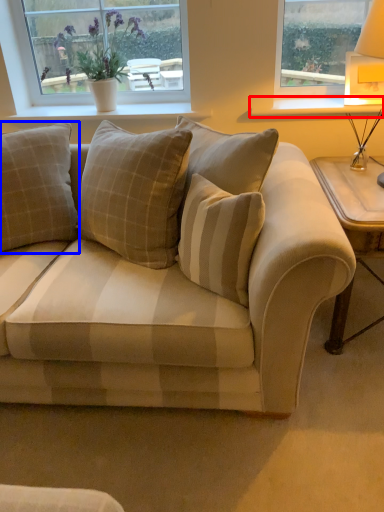
Question: Which object is further to the camera taking this photo, window sill (highlighted by a red box) or pillow (highlighted by a blue box)?

Choices:
 (A) window sill
 (B) pillow

Answer: (A)